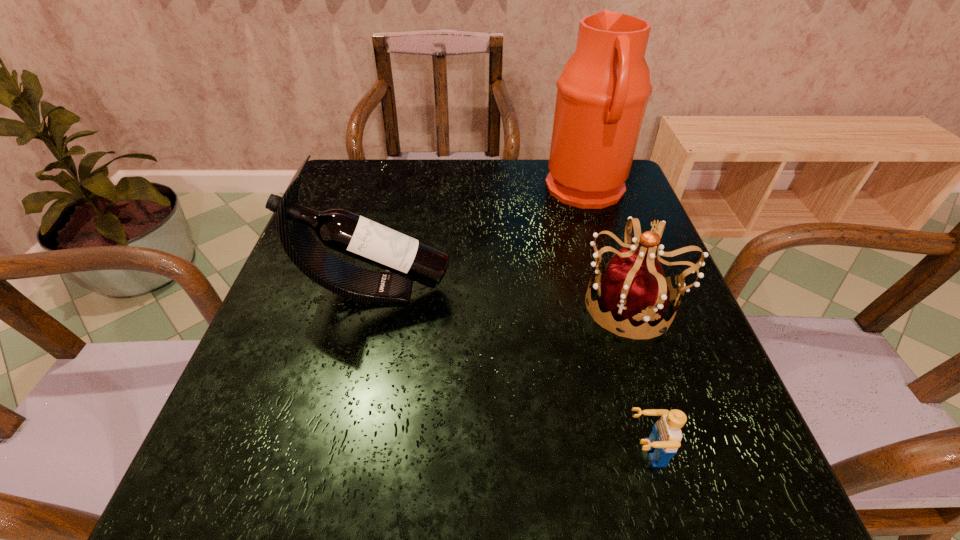
The image size is (960, 540). I want to click on water jug located in the right edge section of the desktop, so click(603, 91).

Identify the location of tiara at the right edge. This screenshot has width=960, height=540. (634, 290).

Locate an element on the screen. Image resolution: width=960 pixels, height=540 pixels. Lego at the right edge is located at coordinates (664, 440).

Locate an element on the screen. The height and width of the screenshot is (540, 960). object situated at the far right corner is located at coordinates (603, 91).

At what (x,y) coordinates should I click in order to perform the action: click on object that is positioned at the near right corner. Please return your answer as a coordinate pair (x, y). The image size is (960, 540). Looking at the image, I should click on (664, 440).

This screenshot has height=540, width=960. Identify the location of blank space at the far edge. (510, 202).

Locate an element on the screen. The width and height of the screenshot is (960, 540). free space at the left edge is located at coordinates (300, 380).

Where is `vacant area at the right edge`? The width and height of the screenshot is (960, 540). vacant area at the right edge is located at coordinates (599, 267).

Locate an element on the screen. Image resolution: width=960 pixels, height=540 pixels. free location at the far left corner of the desktop is located at coordinates tap(348, 201).

In the image, there is a desktop. Identify the location of free space at the near left corner. (251, 501).